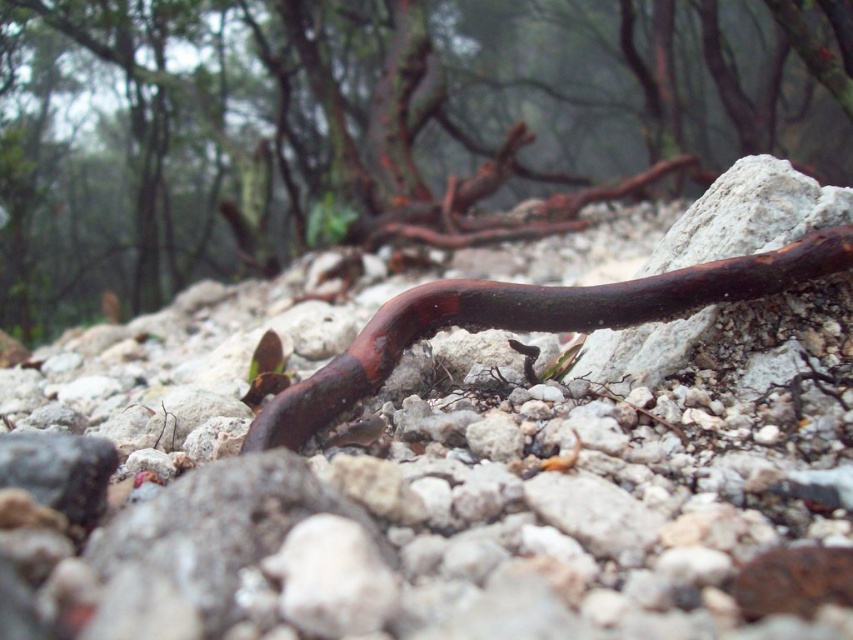
Describe the element at coordinates (376, 125) in the screenshot. I see `glossy brown branch at center` at that location.

Measure the distance between point (518, 157) and camera.

Point (518, 157) and camera are 5.17 meters apart from each other.

At what (x,y) coordinates should I click in order to perform the action: click on glossy brown branch at center. Please return your answer as a coordinate pair (x, y). This screenshot has width=853, height=640. Looking at the image, I should click on (376, 125).